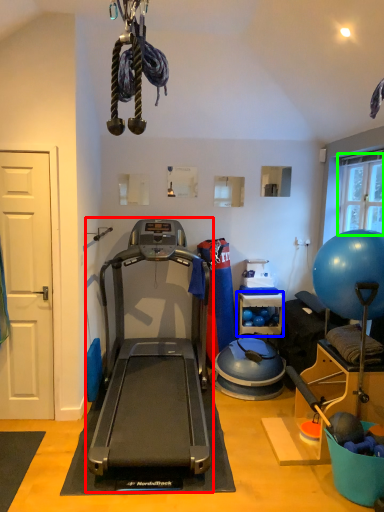
Question: Which object is the farthest from treadmill (highlighted by a red box)? Choose among these: shelf (highlighted by a blue box) or window screen (highlighted by a green box).

Choices:
 (A) shelf
 (B) window screen

Answer: (B)